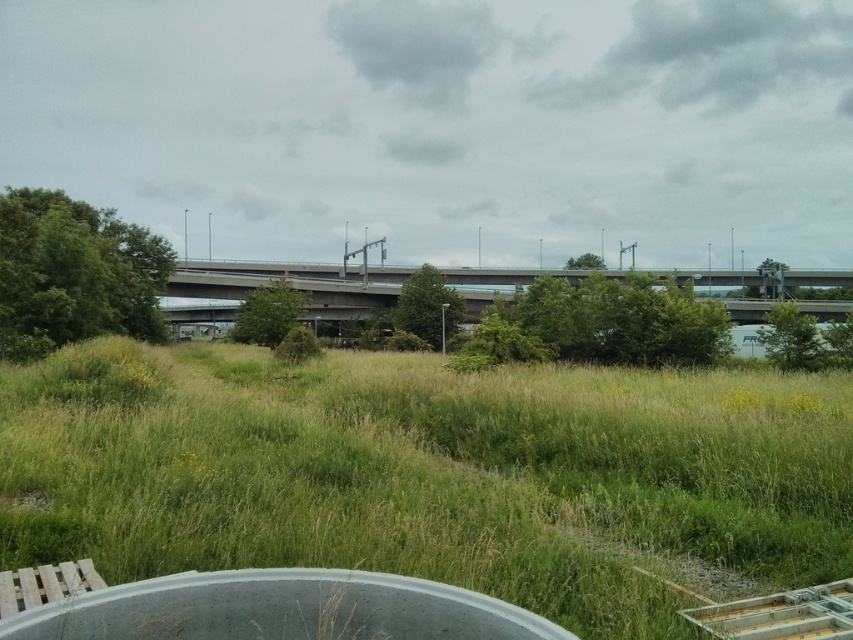
You are a drone operator planning a flight path over the overgrown field. You need to fly from point A to point B. Given that point A is at point(654, 456) and point B is at point(526, 282), will you fly over the highway bridge first or the scattered trees and shrubs first?

Point(654, 456) is in front of point(526, 282), so you will fly over the scattered trees and shrubs first before reaching the highway bridge.

You are a drone operator preparing to fly a drone with a 1.5 meter wingspan. You want to capture aerial footage of the green grassy field at center. What is the minimum safe altitude you should maintain to ensure the drone doesn

The minimum safe altitude should be at least 4.81 meters to ensure the drone is above the green grassy field at center, as it is 4.81 meters away from the camera.

You are a landscape architect planning to install a new walking path. You need to decide whether the green grassy field at center can accommodate a path that is as wide as the concrete bridge at center. Based on their sizes, what would you recommend?

The green grassy field at center is smaller than the concrete bridge at center. Therefore, the path cannot be as wide as the bridge because the field itself is not large enough to accommodate such a width.